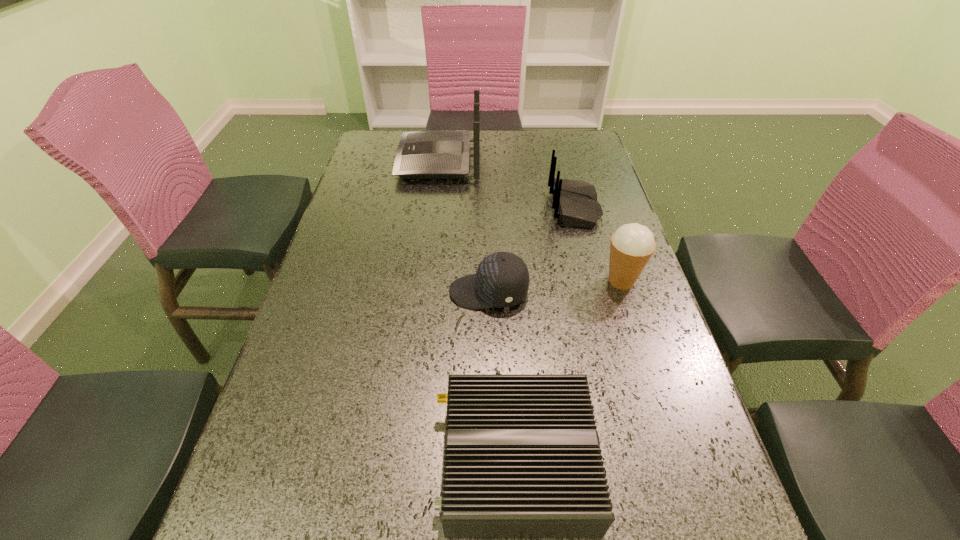
Find the location of a particular element. This screenshot has width=960, height=540. object that stands as the third closest to the nearest router is located at coordinates (575, 202).

Where is `router that is the closest one to the shortest router`? router that is the closest one to the shortest router is located at coordinates (575, 202).

The image size is (960, 540). Identify the location of the second closest router relative to the nearest object. (435, 154).

At what (x,y) coordinates should I click in order to perform the action: click on free space that satisfies the following two spatial constraints: 1. on the front-facing side of the icecream; 2. on the right side of the tallest router. Please return your answer as a coordinate pair (x, y). The image size is (960, 540). Looking at the image, I should click on (424, 281).

Identify the location of free spot that satisfies the following two spatial constraints: 1. on the back of the third shortest object; 2. on the back side of the icecream. (593, 281).

I want to click on blank space that satisfies the following two spatial constraints: 1. on the front side of the icecream; 2. on the back panel of the shortest router, so click(679, 461).

The image size is (960, 540). I want to click on free region that satisfies the following two spatial constraints: 1. on the front-facing side of the icecream; 2. on the right side of the farthest router, so click(424, 281).